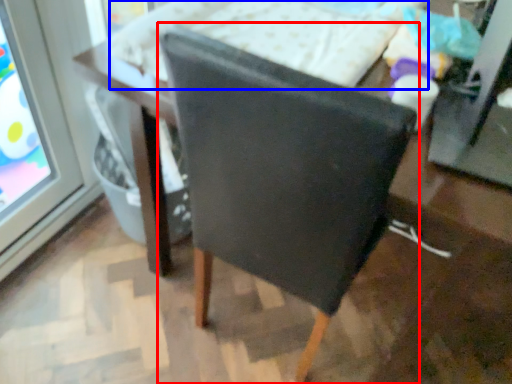
Question: Among these objects, which one is farthest to the camera, chair (highlighted by a red box) or bed (highlighted by a blue box)?

Choices:
 (A) chair
 (B) bed

Answer: (B)